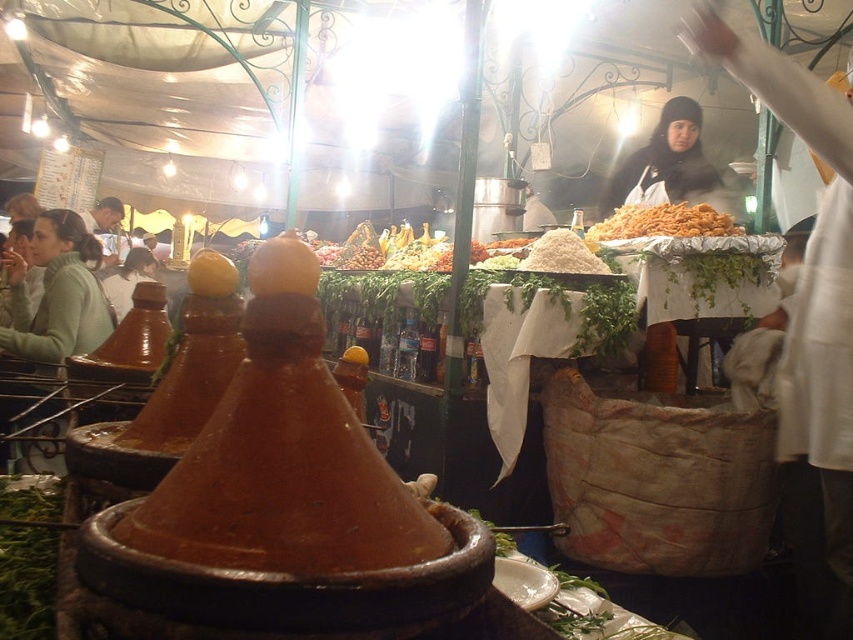
Question: Does black fabric headscarf at upper center appear over golden crispy fried food at center?

Choices:
 (A) no
 (B) yes

Answer: (B)

Question: Can you confirm if golden crispy fried food at center is smaller than white powdery rice at center?

Choices:
 (A) yes
 (B) no

Answer: (B)

Question: Which object is closer to the camera taking this photo?

Choices:
 (A) black fabric headscarf at upper center
 (B) white powdery rice at center
 (C) golden crispy fried food at center

Answer: (B)

Question: Is golden crispy fried food at center above white powdery rice at center?

Choices:
 (A) yes
 (B) no

Answer: (A)

Question: Which of the following is the farthest from the observer?

Choices:
 (A) (654, 227)
 (B) (593, 266)

Answer: (A)

Question: Among these objects, which one is farthest from the camera?

Choices:
 (A) white powdery rice at center
 (B) golden crispy fried food at center
 (C) black fabric headscarf at upper center

Answer: (C)